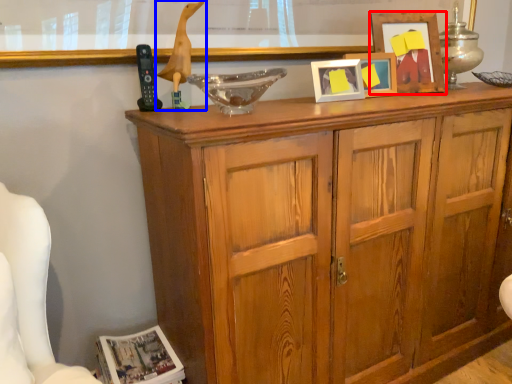
Question: Which of the following is the closest to the observer, picture frame (highlighted by a red box) or mannequin (highlighted by a blue box)?

Choices:
 (A) picture frame
 (B) mannequin

Answer: (B)